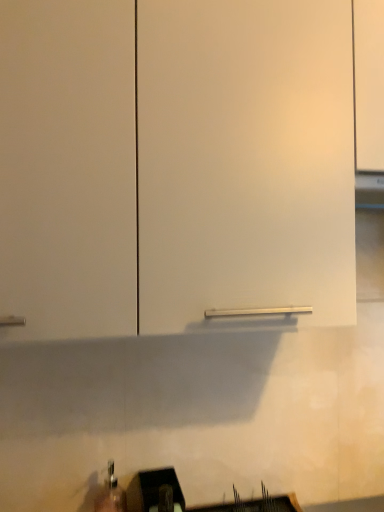
Question: Can you confirm if black plastic sink at lower center is taller than white matte cabinet at center?

Choices:
 (A) yes
 (B) no

Answer: (B)

Question: Could you tell me if black plastic sink at lower center is facing white matte cabinet at center?

Choices:
 (A) yes
 (B) no

Answer: (B)

Question: Considering the relative sizes of black plastic sink at lower center and white matte cabinet at center in the image provided, is black plastic sink at lower center thinner than white matte cabinet at center?

Choices:
 (A) no
 (B) yes

Answer: (B)

Question: Would you say black plastic sink at lower center is a long distance from white matte cabinet at center?

Choices:
 (A) no
 (B) yes

Answer: (A)

Question: From the image's perspective, is black plastic sink at lower center on top of white matte cabinet at center?

Choices:
 (A) yes
 (B) no

Answer: (B)

Question: Is black plastic sink at lower center positioned beyond the bounds of white matte cabinet at center?

Choices:
 (A) no
 (B) yes

Answer: (B)

Question: Considering the relative positions of white matte cabinet at center and black plastic sink at lower center in the image provided, is white matte cabinet at center to the right of black plastic sink at lower center from the viewer's perspective?

Choices:
 (A) no
 (B) yes

Answer: (B)

Question: Considering the relative sizes of white matte cabinet at center and black plastic sink at lower center in the image provided, is white matte cabinet at center bigger than black plastic sink at lower center?

Choices:
 (A) yes
 (B) no

Answer: (A)

Question: Does white matte cabinet at center have a greater height compared to black plastic sink at lower center?

Choices:
 (A) no
 (B) yes

Answer: (B)

Question: Is white matte cabinet at center thinner than black plastic sink at lower center?

Choices:
 (A) yes
 (B) no

Answer: (B)

Question: Does white matte cabinet at center have a lesser height compared to black plastic sink at lower center?

Choices:
 (A) no
 (B) yes

Answer: (A)

Question: Does white matte cabinet at center turn towards black plastic sink at lower center?

Choices:
 (A) yes
 (B) no

Answer: (B)

Question: Does point (233, 506) appear closer or farther from the camera than point (150, 276)?

Choices:
 (A) farther
 (B) closer

Answer: (A)